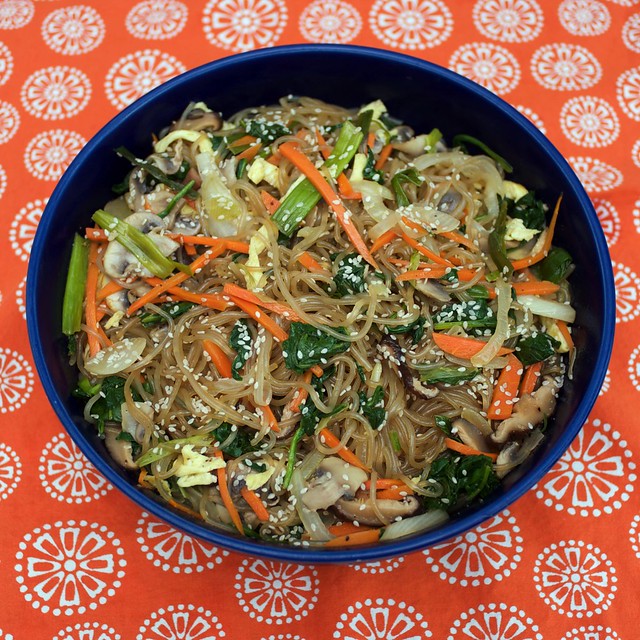
You are a GUI agent. You are given a task and a screenshot of the screen. Output one action in this format:
    pyautogui.click(x=<x>, y=<y>)
    Task: Click on the tablecloth
    This screenshot has width=640, height=640.
    Given the screenshot: What is the action you would take?
    pyautogui.click(x=576, y=508)